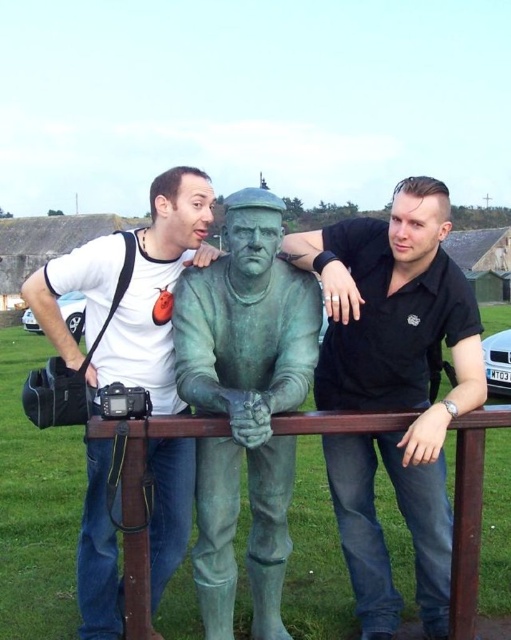
Question: Among these points, which one is nearest to the camera?

Choices:
 (A) (415, 460)
 (B) (479, 417)
 (C) (221, 556)

Answer: (A)

Question: Which of the following is the closest to the observer?

Choices:
 (A) black matte shirt at center
 (B) white matte t-shirt at upper left

Answer: (A)

Question: Does white matte t-shirt at upper left appear on the right side of brown wooden rail at center?

Choices:
 (A) yes
 (B) no

Answer: (B)

Question: Does black matte shirt at center come in front of green patina statue at center?

Choices:
 (A) no
 (B) yes

Answer: (A)

Question: Is white matte t-shirt at upper left bigger than brown wooden rail at center?

Choices:
 (A) no
 (B) yes

Answer: (B)

Question: Which object is closer to the camera taking this photo?

Choices:
 (A) green patina statue at center
 (B) black matte shirt at center

Answer: (A)